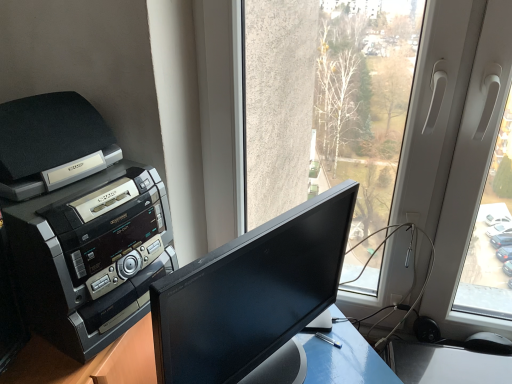
Question: Does black glossy monitor at center come in front of black plastic printer at left?

Choices:
 (A) yes
 (B) no

Answer: (A)

Question: Is black glossy monitor at center taller than black plastic printer at left?

Choices:
 (A) no
 (B) yes

Answer: (A)

Question: Can you confirm if black glossy monitor at center is thinner than black plastic printer at left?

Choices:
 (A) no
 (B) yes

Answer: (B)

Question: From a real-world perspective, does black glossy monitor at center stand above black plastic printer at left?

Choices:
 (A) no
 (B) yes

Answer: (A)

Question: Would you say black plastic printer at left is part of black glossy monitor at center's contents?

Choices:
 (A) no
 (B) yes

Answer: (A)

Question: Is black plastic printer at left in front of or behind black glossy monitor at center in the image?

Choices:
 (A) front
 (B) behind

Answer: (B)

Question: Is black plastic printer at left situated inside black glossy monitor at center or outside?

Choices:
 (A) outside
 (B) inside

Answer: (A)

Question: In terms of height, does black plastic printer at left look taller or shorter compared to black glossy monitor at center?

Choices:
 (A) short
 (B) tall

Answer: (B)

Question: Is point (73, 226) closer or farther from the camera than point (297, 354)?

Choices:
 (A) closer
 (B) farther

Answer: (A)

Question: Is black plastic mouse at lower right inside the boundaries of black glossy monitor at center, or outside?

Choices:
 (A) outside
 (B) inside

Answer: (A)

Question: In the image, is black plastic mouse at lower right on the left side or the right side of black glossy monitor at center?

Choices:
 (A) right
 (B) left

Answer: (A)

Question: Considering their positions, is black plastic mouse at lower right located in front of or behind black glossy monitor at center?

Choices:
 (A) front
 (B) behind

Answer: (B)

Question: From their relative heights in the image, would you say black plastic mouse at lower right is taller or shorter than black glossy monitor at center?

Choices:
 (A) short
 (B) tall

Answer: (A)

Question: Is point (31, 326) positioned closer to the camera than point (472, 340)?

Choices:
 (A) farther
 (B) closer

Answer: (B)

Question: From a real-world perspective, is black plastic printer at left above or below black plastic mouse at lower right?

Choices:
 (A) below
 (B) above

Answer: (B)